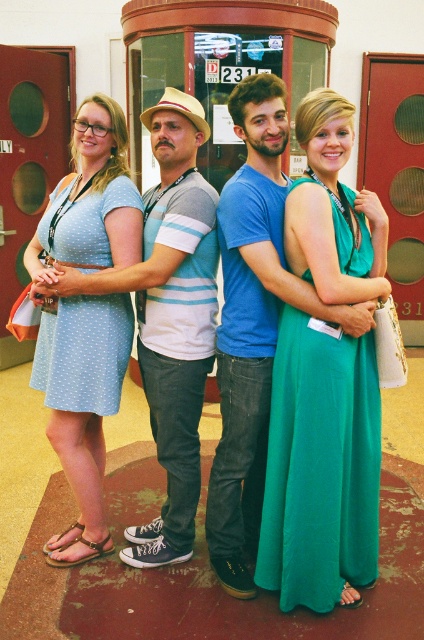
Who is more distant from viewer, (x=318, y=321) or (x=81, y=362)?

Point (x=81, y=362)

Between point (293, 577) and point (81, 392), which one is positioned behind?

Point (81, 392)

The height and width of the screenshot is (640, 424). Identify the location of emerald green satin dress at center. (320, 465).

Can you confirm if light blue dotted dress at left is wider than light blue dotted fabric dress at left?

Yes.

Who is lower down, light blue dotted dress at left or light blue dotted fabric dress at left?

light blue dotted dress at left

Between point (89, 195) and point (61, 220), which one is positioned in front?

Point (61, 220)

Find the location of a particular element. light blue dotted dress at left is located at coordinates (83, 406).

Which is below, emerald green satin dress at center or light blue dotted dress at left?

emerald green satin dress at center

Who is positioned more to the left, emerald green satin dress at center or light blue dotted dress at left?

light blue dotted dress at left is more to the left.

The width and height of the screenshot is (424, 640). In order to click on emerald green satin dress at center in this screenshot , I will do `click(320, 465)`.

Identify the location of emerald green satin dress at center. [320, 465].